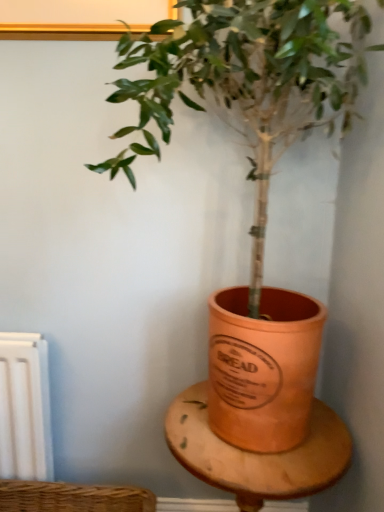
This screenshot has height=512, width=384. I want to click on empty space that is ontop of wooden table at center (from a real-world perspective), so click(266, 442).